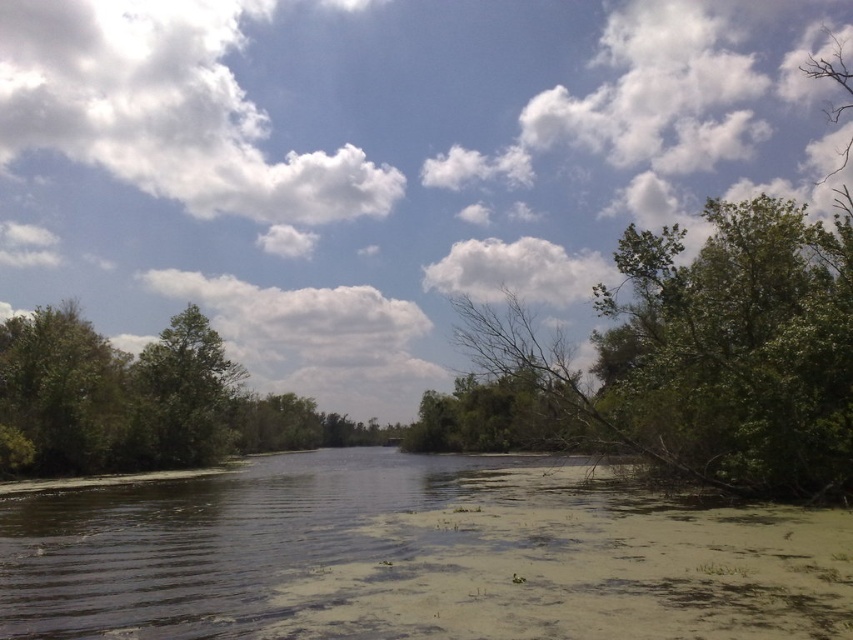
Question: Is green algae-covered water at center above green leafy tree at upper right?

Choices:
 (A) yes
 (B) no

Answer: (B)

Question: Does green leafy tree at upper right appear under green leafy tree at center?

Choices:
 (A) no
 (B) yes

Answer: (A)

Question: Which object is positioned closest to the green leafy tree at center?

Choices:
 (A) green leafy tree at left
 (B) green leafy tree at upper right

Answer: (A)

Question: Which object is closer to the camera taking this photo?

Choices:
 (A) green leafy tree at left
 (B) green leafy tree at upper right
 (C) green algae-covered water at center
 (D) green leafy tree at center

Answer: (C)

Question: Can you confirm if green leafy tree at upper right is positioned below green leafy tree at left?

Choices:
 (A) yes
 (B) no

Answer: (B)

Question: Which point is closer to the camera?

Choices:
 (A) green leafy tree at left
 (B) green leafy tree at center
 (C) green algae-covered water at center

Answer: (C)